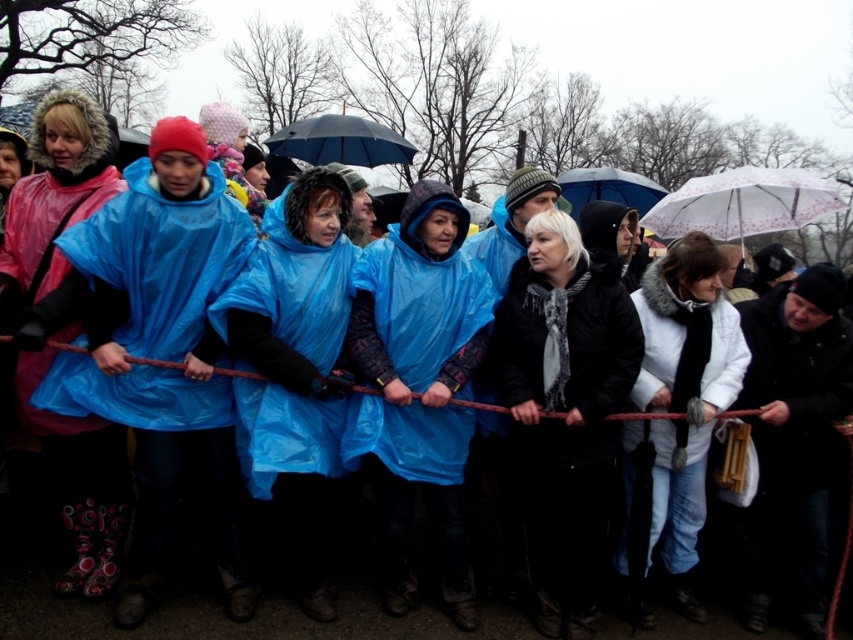
You are a photographer trying to capture a photo of the black matte jacket at center and the transparent plastic umbrella at center. Which object should you zoom in on to ensure both fit in the frame without cropping?

The black matte jacket at center is narrower than the transparent plastic umbrella at center, so you should zoom in on the transparent plastic umbrella at center to ensure both fit in the frame without cropping.